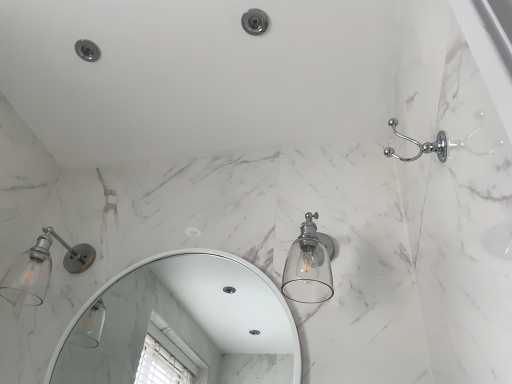
Question: From the image's perspective, is chrome metallic showerhead at upper center below white glossy mirror at center?

Choices:
 (A) no
 (B) yes

Answer: (A)

Question: Is chrome metallic showerhead at upper center in contact with white glossy mirror at center?

Choices:
 (A) no
 (B) yes

Answer: (A)

Question: Could you tell me if chrome metallic showerhead at upper center is facing white glossy mirror at center?

Choices:
 (A) no
 (B) yes

Answer: (A)

Question: Can you confirm if chrome metallic showerhead at upper center is wider than white glossy mirror at center?

Choices:
 (A) no
 (B) yes

Answer: (B)

Question: Is chrome metallic showerhead at upper center located outside white glossy mirror at center?

Choices:
 (A) no
 (B) yes

Answer: (B)

Question: In terms of width, does matte silver glass sconce at left, which is counted as the 1th light fixture, starting from the left, look wider or thinner when compared to matte white bathtub at upper right?

Choices:
 (A) thin
 (B) wide

Answer: (A)

Question: In terms of size, does matte silver glass sconce at left, which is counted as the 1th light fixture, starting from the left, appear bigger or smaller than matte white bathtub at upper right?

Choices:
 (A) big
 (B) small

Answer: (B)

Question: In the image, is matte silver glass sconce at left, arranged as the 2th light fixture when viewed from the right, positioned in front of or behind matte white bathtub at upper right?

Choices:
 (A) behind
 (B) front

Answer: (A)

Question: Is matte silver glass sconce at left, arranged as the 2th light fixture when viewed from the right, inside or outside of matte white bathtub at upper right?

Choices:
 (A) inside
 (B) outside

Answer: (B)

Question: Is chrome metallic showerhead at upper center inside the boundaries of clear glass light fixture at center-right, the first light fixture positioned from the right, or outside?

Choices:
 (A) outside
 (B) inside

Answer: (A)

Question: From a real-world perspective, relative to clear glass light fixture at center-right, arranged as the second light fixture when viewed from the left, is chrome metallic showerhead at upper center vertically above or below?

Choices:
 (A) above
 (B) below

Answer: (A)

Question: Considering the positions of chrome metallic showerhead at upper center and clear glass light fixture at center-right, the first light fixture positioned from the right, in the image, is chrome metallic showerhead at upper center bigger or smaller than clear glass light fixture at center-right, the first light fixture positioned from the right,?

Choices:
 (A) big
 (B) small

Answer: (B)

Question: In the image, is chrome metallic showerhead at upper center on the left side or the right side of clear glass light fixture at center-right, arranged as the second light fixture when viewed from the left?

Choices:
 (A) left
 (B) right

Answer: (A)

Question: Is point (247, 29) positioned closer to the camera than point (216, 69)?

Choices:
 (A) farther
 (B) closer

Answer: (B)

Question: Considering the positions of chrome metallic showerhead at upper center and matte white bathtub at upper right in the image, is chrome metallic showerhead at upper center wider or thinner than matte white bathtub at upper right?

Choices:
 (A) thin
 (B) wide

Answer: (A)